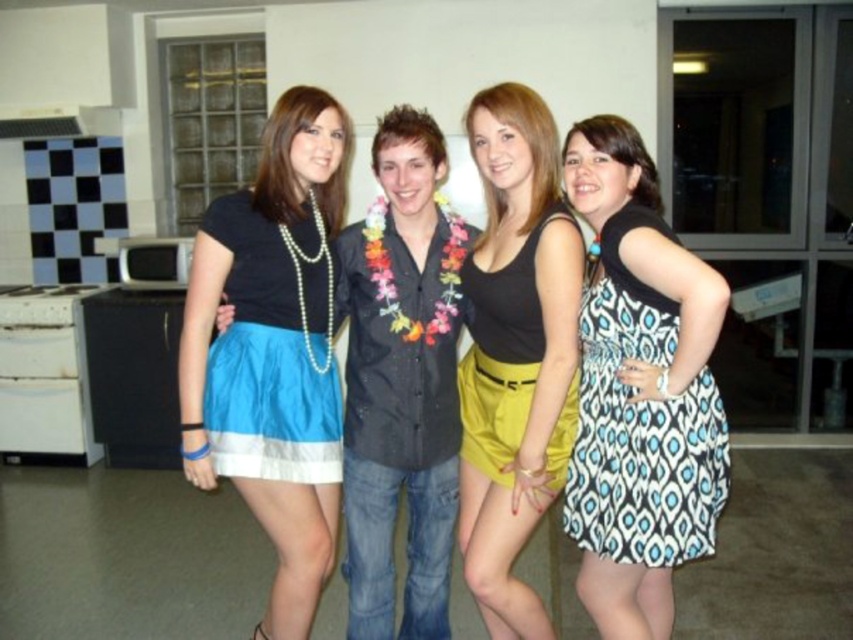
Question: Among these objects, which one is farthest from the camera?

Choices:
 (A) shiny blue skirt at center
 (B) blue satin skirt at center
 (C) matte black tank top at center
 (D) black and white patterned dress at right

Answer: (B)

Question: Can you confirm if shiny blue skirt at center is positioned above matte black tank top at center?

Choices:
 (A) yes
 (B) no

Answer: (B)

Question: Is matte black tank top at center to the right of blue satin skirt at center from the viewer's perspective?

Choices:
 (A) yes
 (B) no

Answer: (A)

Question: Considering the real-world distances, which object is farthest from the matte black tank top at center?

Choices:
 (A) blue satin skirt at center
 (B) shiny blue skirt at center

Answer: (A)

Question: Can you confirm if shiny blue skirt at center is positioned to the right of matte black tank top at center?

Choices:
 (A) no
 (B) yes

Answer: (A)

Question: Which point is closer to the camera?

Choices:
 (A) (254, 273)
 (B) (305, 333)
 (C) (708, 490)

Answer: (C)